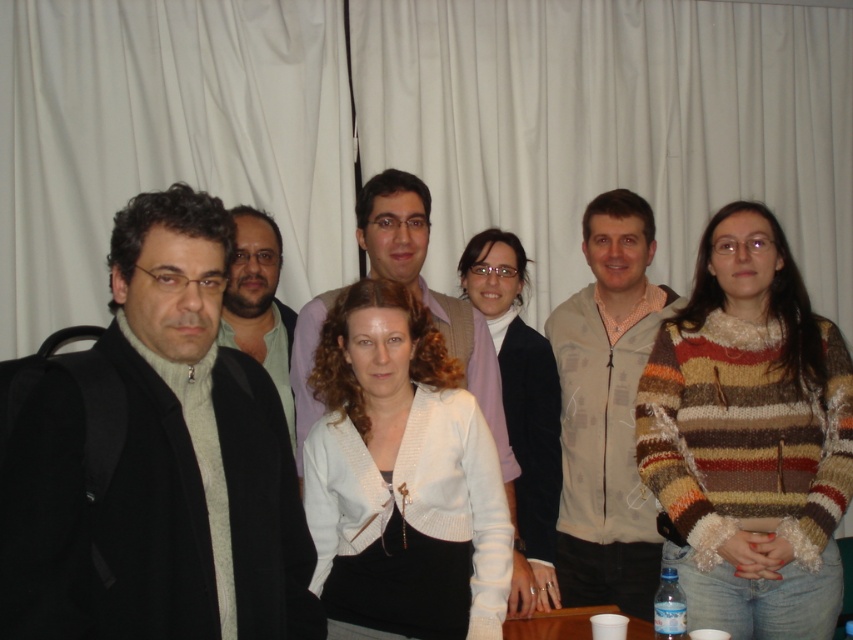
You are a photographer trying to adjust the lighting for a group photo. You notice the white knitted cardigan at center and the matte green shirt at center. Which clothing item requires more space between the individuals to avoid overlapping in the frame?

The white knitted cardigan at center requires more space because its width is larger than the matte green shirt at center.

You are standing in front of a group photo. You want to know if you can reach the white knitted cardigan at center without moving closer than 6 feet. Can you?

The white knitted cardigan at center and viewer are 6.45 feet apart from each other. Since 6.45 feet is more than 6 feet, you can reach it without moving closer than 6 feet.

You are a photographer trying to adjust the spacing between the two white knitted items at the center of the image. The minimum distance required for proper lighting is 20 inches. Can you confirm if the current distance between the white knitted cardigan at center and the white knitted sweater at center meets this requirement?

The white knitted cardigan at center and white knitted sweater at center are 22.43 inches apart, which exceeds the minimum required distance of 20 inches for proper lighting. Therefore, the current spacing is sufficient.